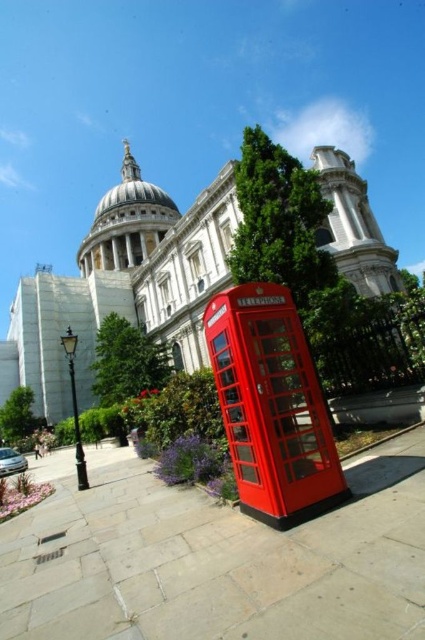
Question: Is slate gray paving stone at lower center thinner than glossy red telephone box at lower center?

Choices:
 (A) yes
 (B) no

Answer: (B)

Question: Which of the following is the farthest from the observer?

Choices:
 (A) (297, 468)
 (B) (181, 548)

Answer: (A)

Question: Is slate gray paving stone at lower center thinner than glossy red telephone box at lower center?

Choices:
 (A) no
 (B) yes

Answer: (A)

Question: Which of the following is the farthest from the observer?

Choices:
 (A) glossy red telephone box at lower center
 (B) slate gray paving stone at lower center

Answer: (A)

Question: Can you confirm if slate gray paving stone at lower center is thinner than glossy red telephone box at lower center?

Choices:
 (A) no
 (B) yes

Answer: (A)